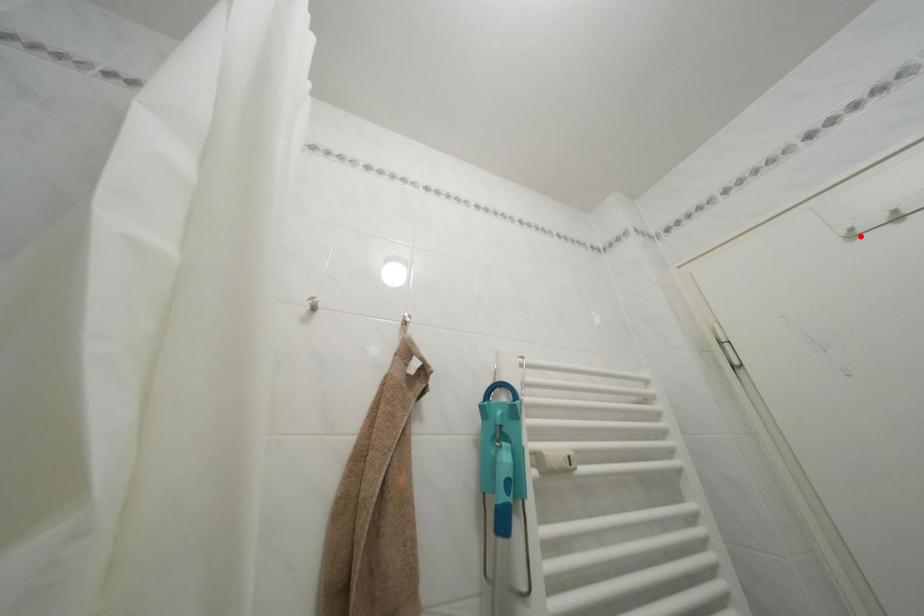
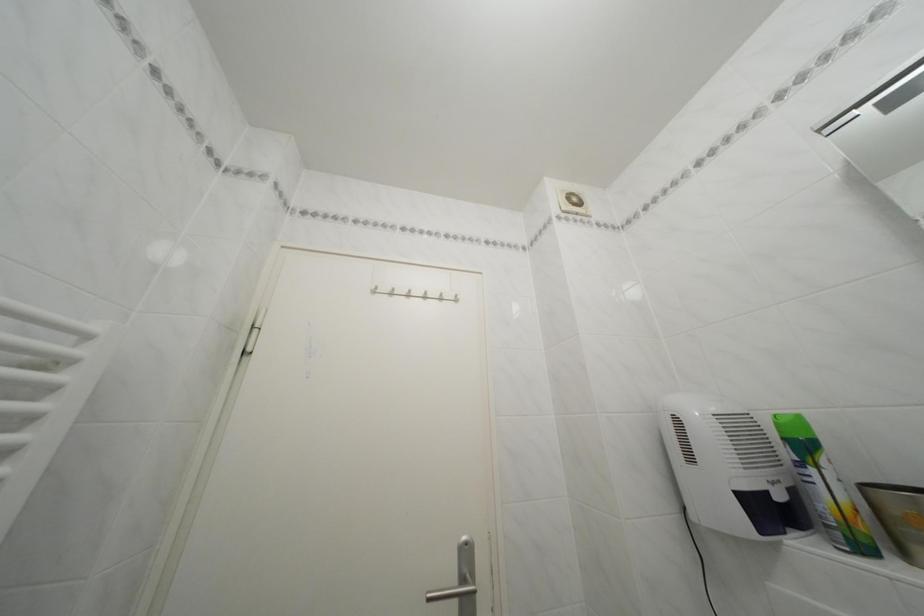
Locate, in the second image, the point that corresponds to the highlighted location in the first image.

(385, 294)